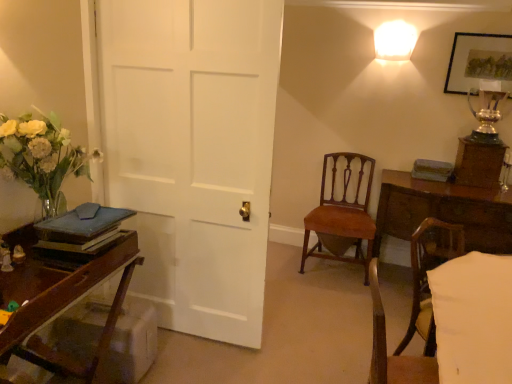
Where is `free space below mahogany wood chair at center, the 1th chair viewed from the back (from a real-world perspective)`? The width and height of the screenshot is (512, 384). free space below mahogany wood chair at center, the 1th chair viewed from the back (from a real-world perspective) is located at coordinates (338, 274).